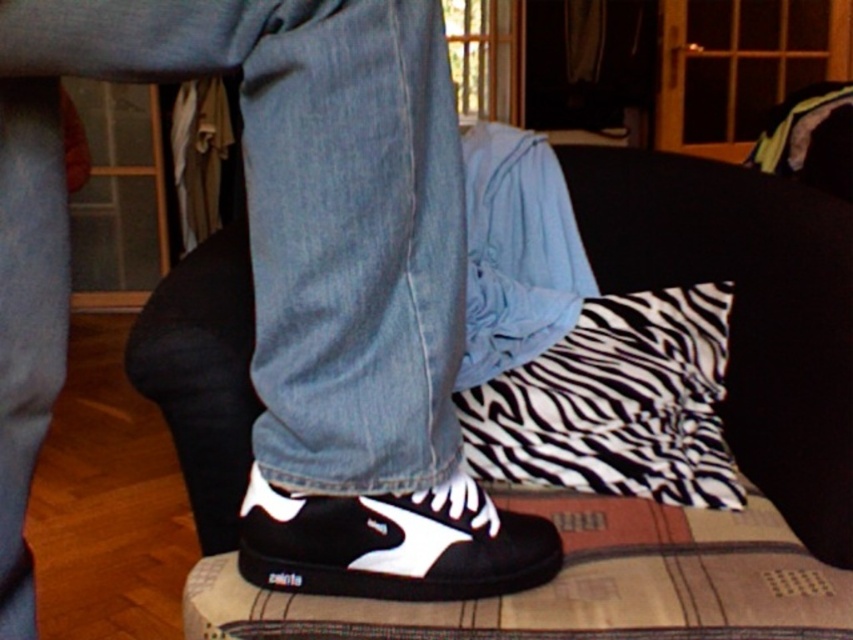
Question: Can you confirm if black matte sneakers at center is positioned to the right of zebra-patterned fabric at center?

Choices:
 (A) yes
 (B) no

Answer: (B)

Question: Does black matte sneakers at center appear under zebra-patterned fabric at center?

Choices:
 (A) yes
 (B) no

Answer: (A)

Question: Can you confirm if black matte sneakers at center is wider than black canvas shoe at center?

Choices:
 (A) no
 (B) yes

Answer: (B)

Question: Which object is the closest to the black matte sneakers at center?

Choices:
 (A) black canvas shoe at center
 (B) zebra-patterned fabric at center

Answer: (A)

Question: Which point is farther from the camera taking this photo?

Choices:
 (A) (316, 516)
 (B) (495, 536)

Answer: (B)

Question: Which is farther from the zebra-patterned fabric at center?

Choices:
 (A) black matte sneakers at center
 (B) black canvas shoe at center

Answer: (A)